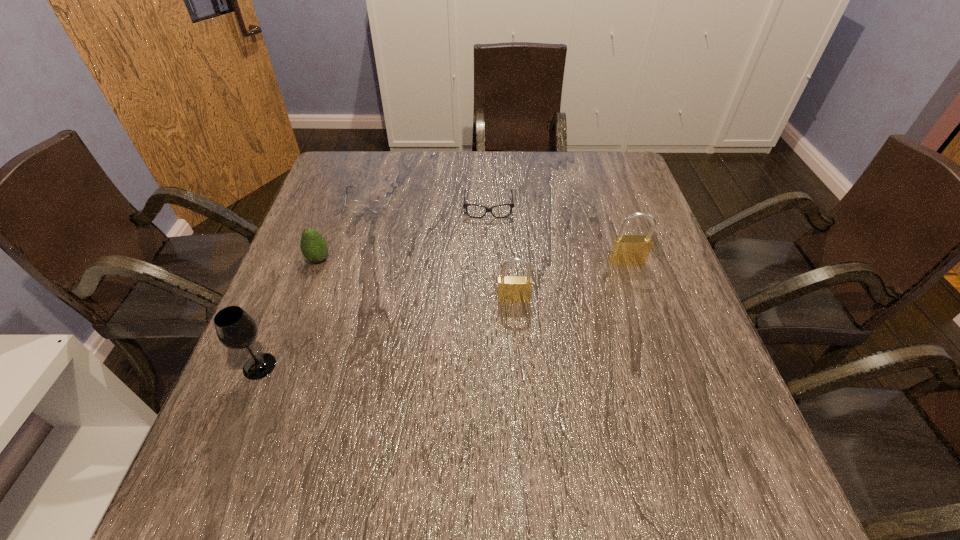
Please show where to add a padlock on the left while keeping spacing even. Please provide its 2D coordinates. Your answer should be formatted as a tuple, i.e. [(x, y)], where the tuple contains the x and y coordinates of a point satisfying the conditions above.

[(380, 342)]